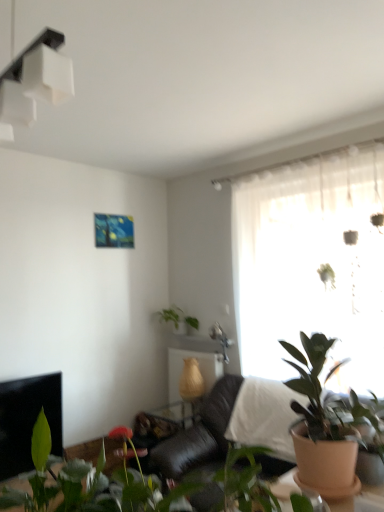
Where is `wooden at center`? wooden at center is located at coordinates (194, 358).

Locate an element on the screen. The height and width of the screenshot is (512, 384). green matte plant at lower left, which is counted as the first houseplant, starting from the front is located at coordinates (87, 484).

What do you see at coordinates (87, 484) in the screenshot? This screenshot has height=512, width=384. I see `green matte plant at lower left, the third houseplant from the back` at bounding box center [87, 484].

Describe the element at coordinates (312, 264) in the screenshot. I see `translucent glass window at center` at that location.

What do you see at coordinates (325, 425) in the screenshot? I see `green matte plant at right, positioned as the second houseplant in front-to-back order` at bounding box center [325, 425].

You are a GUI agent. You are given a task and a screenshot of the screen. Output one action in this format:
    pyautogui.click(x=<x>, y=<y>)
    Task: Click on the black leather couch at center
    This screenshot has height=512, width=384.
    Given the screenshot: What is the action you would take?
    pyautogui.click(x=199, y=436)

Is black leather couch at center turned away from green matte plant at upper center, arranged as the 1th houseplant when viewed from the back?

No, green matte plant at upper center, arranged as the 1th houseplant when viewed from the back, is not at the back of black leather couch at center.

Looking at this image, considering the sizes of black leather couch at center and green matte plant at upper center, which appears as the third houseplant when viewed from the front, in the image, is black leather couch at center wider or thinner than green matte plant at upper center, which appears as the third houseplant when viewed from the front,?

black leather couch at center is wider than green matte plant at upper center, which appears as the third houseplant when viewed from the front.

Is the position of black leather couch at center less distant than that of green matte plant at upper center, arranged as the 1th houseplant when viewed from the back?

Yes, black leather couch at center is in front of green matte plant at upper center, arranged as the 1th houseplant when viewed from the back.

From the image's perspective, which one is positioned lower, black leather couch at center or green matte plant at upper center, which appears as the third houseplant when viewed from the front?

black leather couch at center, from the image's perspective.

From a real-world perspective, relative to green matte plant at right, positioned as the second houseplant in front-to-back order, is green matte plant at lower left, the third houseplant from the back, vertically above or below?

From a real-world perspective, green matte plant at lower left, the third houseplant from the back, is physically above green matte plant at right, positioned as the second houseplant in front-to-back order.

From the image's perspective, which houseplant is the 1st one below the green matte plant at lower left, which is counted as the first houseplant, starting from the front? Please provide its 2D coordinates.

[(325, 425)]

Visually, is green matte plant at lower left, the third houseplant from the back, positioned to the left or to the right of green matte plant at right, which is the 2th houseplant in back-to-front order?

Clearly, green matte plant at lower left, the third houseplant from the back, is on the left of green matte plant at right, which is the 2th houseplant in back-to-front order, in the image.

From the image's perspective, is green matte plant at lower left, the third houseplant from the back, beneath green matte plant at right, positioned as the second houseplant in front-to-back order?

No, from the image's perspective, green matte plant at lower left, the third houseplant from the back, is not below green matte plant at right, positioned as the second houseplant in front-to-back order.

Locate an element on the screen. The height and width of the screenshot is (512, 384). the 1st houseplant above the black leather couch at center (from a real-world perspective) is located at coordinates (325, 425).

Is black leather couch at center inside or outside of green matte plant at right, which is the 2th houseplant in back-to-front order?

black leather couch at center is located beyond the bounds of green matte plant at right, which is the 2th houseplant in back-to-front order.

Is black leather couch at center in contact with green matte plant at right, which is the 2th houseplant in back-to-front order?

black leather couch at center is not next to green matte plant at right, which is the 2th houseplant in back-to-front order, and they're not touching.

Measure the distance from green matte plant at upper center, which appears as the third houseplant when viewed from the front, to green matte plant at lower left, which is counted as the first houseplant, starting from the front.

green matte plant at upper center, which appears as the third houseplant when viewed from the front, and green matte plant at lower left, which is counted as the first houseplant, starting from the front, are 9.36 feet apart.

From a real-world perspective, is green matte plant at upper center, which appears as the third houseplant when viewed from the front, physically located above or below green matte plant at lower left, which is counted as the first houseplant, starting from the front?

green matte plant at upper center, which appears as the third houseplant when viewed from the front, is above green matte plant at lower left, which is counted as the first houseplant, starting from the front.

Between green matte plant at upper center, arranged as the 1th houseplant when viewed from the back, and green matte plant at lower left, the third houseplant from the back, which one has larger size?

green matte plant at lower left, the third houseplant from the back.

Locate an element on the screen. The width and height of the screenshot is (384, 512). houseplant that is the 2nd object located in front of the green matte plant at upper center, which appears as the third houseplant when viewed from the front is located at coordinates (87, 484).

From a real-world perspective, is green matte plant at right, positioned as the second houseplant in front-to-back order, beneath black glossy fireplace at lower left?

No, from a real-world perspective, green matte plant at right, positioned as the second houseplant in front-to-back order, is not beneath black glossy fireplace at lower left.

How many degrees apart are the facing directions of green matte plant at right, positioned as the second houseplant in front-to-back order, and black glossy fireplace at lower left?

green matte plant at right, positioned as the second houseplant in front-to-back order, and black glossy fireplace at lower left are facing 180 degrees away from each other.

Can you confirm if green matte plant at right, positioned as the second houseplant in front-to-back order, is thinner than black glossy fireplace at lower left?

No, green matte plant at right, positioned as the second houseplant in front-to-back order, is not thinner than black glossy fireplace at lower left.

Does point (327, 461) lie in front of point (0, 445)?

Yes.

Which is behind, green matte plant at right, which is the 2th houseplant in back-to-front order, or green matte plant at lower left, the third houseplant from the back?

Positioned behind is green matte plant at right, which is the 2th houseplant in back-to-front order.

Can you confirm if green matte plant at right, which is the 2th houseplant in back-to-front order, is wider than green matte plant at lower left, which is counted as the first houseplant, starting from the front?

Indeed, green matte plant at right, which is the 2th houseplant in back-to-front order, has a greater width compared to green matte plant at lower left, which is counted as the first houseplant, starting from the front.

Is green matte plant at lower left, the third houseplant from the back, a part of green matte plant at right, positioned as the second houseplant in front-to-back order?

No, green matte plant at right, positioned as the second houseplant in front-to-back order, does not contain green matte plant at lower left, the third houseplant from the back.

Considering the positions of objects green matte plant at lower left, which is counted as the first houseplant, starting from the front, and wooden at center in the image provided, who is more to the left, green matte plant at lower left, which is counted as the first houseplant, starting from the front, or wooden at center?

From the viewer's perspective, green matte plant at lower left, which is counted as the first houseplant, starting from the front, appears more on the left side.

From the image's perspective, which object appears higher, green matte plant at lower left, the third houseplant from the back, or wooden at center?

green matte plant at lower left, the third houseplant from the back, is shown above in the image.

Which houseplant is the 2nd one when counting from the front of the wooden at center? Please provide its 2D coordinates.

[(87, 484)]

Is green matte plant at lower left, which is counted as the first houseplant, starting from the front, facing towards wooden at center?

No, green matte plant at lower left, which is counted as the first houseplant, starting from the front, is not turned towards wooden at center.

Locate an element on the screen. Image resolution: width=384 pixels, height=512 pixels. couch on the right of green matte plant at upper center, arranged as the 1th houseplant when viewed from the back is located at coordinates (199, 436).

Starting from the green matte plant at lower left, which is counted as the first houseplant, starting from the front, which houseplant is the 1st one behind? Please provide its 2D coordinates.

[(325, 425)]

When comparing their distances from wooden at center, does green matte plant at right, which is the 2th houseplant in back-to-front order, or black glossy fireplace at lower left seem closer?

The object closer to wooden at center is black glossy fireplace at lower left.

Looking at the image, which one is located closer to green matte plant at right, positioned as the second houseplant in front-to-back order, green matte plant at lower left, the third houseplant from the back, or white matte light fixture at upper left?

Based on the image, green matte plant at lower left, the third houseplant from the back, appears to be nearer to green matte plant at right, positioned as the second houseplant in front-to-back order.

Consider the image. From the image, which object appears to be nearer to black leather couch at center, black glossy fireplace at lower left or translucent glass window at center?

The object closer to black leather couch at center is black glossy fireplace at lower left.

Based on their spatial positions, is wooden at center or green matte plant at upper center, arranged as the 1th houseplant when viewed from the back, further from white glossy shelf at center?

The object further to white glossy shelf at center is green matte plant at upper center, arranged as the 1th houseplant when viewed from the back.

From the picture: Looking at the image, which one is located further to green matte plant at lower left, the third houseplant from the back, green matte plant at right, which is the 2th houseplant in back-to-front order, or black leather couch at center?

The object further to green matte plant at lower left, the third houseplant from the back, is black leather couch at center.

From the image, which object appears to be farther from wooden at center, green matte plant at right, which is the 2th houseplant in back-to-front order, or green matte plant at lower left, the third houseplant from the back?

Based on the image, green matte plant at lower left, the third houseplant from the back, appears to be further to wooden at center.

Which object lies nearer to the anchor point black leather couch at center, translucent glass window at center or green matte plant at lower left, which is counted as the first houseplant, starting from the front?

translucent glass window at center lies closer to black leather couch at center than the other object.

Estimate the real-world distances between objects in this image. Which object is further from green matte plant at upper center, arranged as the 1th houseplant when viewed from the back, white matte light fixture at upper left or white glossy shelf at center?

white matte light fixture at upper left.

You are a GUI agent. You are given a task and a screenshot of the screen. Output one action in this format:
    pyautogui.click(x=<x>, y=<y>)
    Task: Click on the window sill between black leather couch at center and green matte plant at upper center, which appears as the third houseplant when viewed from the front, from front to back
    This screenshot has height=512, width=384.
    Given the screenshot: What is the action you would take?
    pyautogui.click(x=195, y=343)

Locate an element on the screen. This screenshot has height=512, width=384. light fixture between green matte plant at lower left, the third houseplant from the back, and black glossy fireplace at lower left in the front-back direction is located at coordinates [34, 82].

I want to click on couch between white matte light fixture at upper left and wooden at center from front to back, so click(199, 436).

Locate an element on the screen. This screenshot has height=512, width=384. table positioned between green matte plant at right, positioned as the second houseplant in front-to-back order, and white glossy shelf at center from near to far is located at coordinates (194, 358).